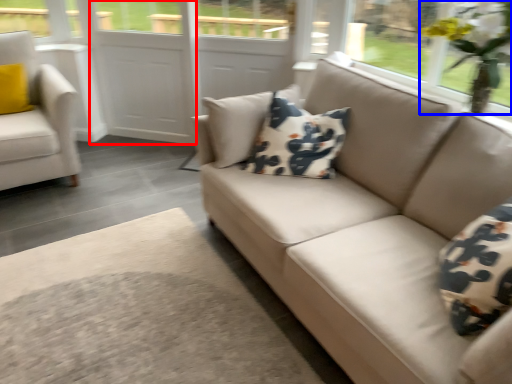
Question: Which of the following is the closest to the observer, screen door (highlighted by a red box) or floral arrangement (highlighted by a blue box)?

Choices:
 (A) screen door
 (B) floral arrangement

Answer: (B)